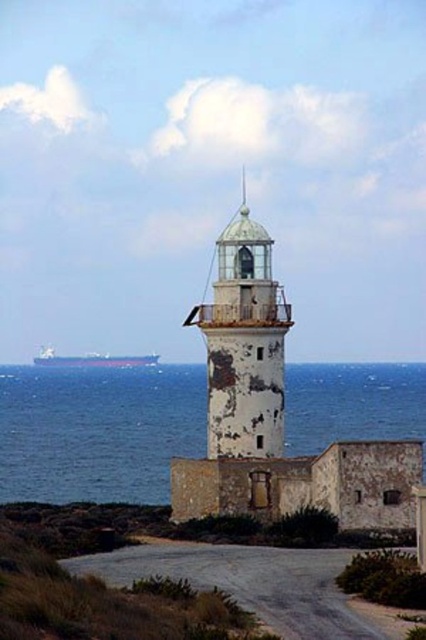
Consider the image. You are standing at the base of the lighthouse and see two points marked in the image. The first point is at coordinates point (224, 422) and the second is at point (34, 362). Which point is closer to you?

Point (224, 422) is in front of point (34, 362), so it is closer to you.

You are a painter planning to sketch the lighthouse scene. You want to ensure the blue water at center and the white weathered tower at center are proportionally accurate. Which object should you draw wider in your sketch?

The blue water at center should be drawn wider than the white weathered tower at center since its width surpasses the tower.